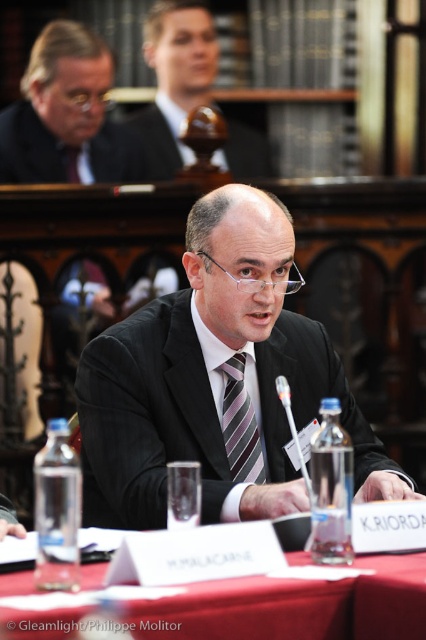
Which of these two, black matte suit at center or matte black suit at upper center, stands shorter?

black matte suit at center

The image size is (426, 640). Describe the element at coordinates (216, 381) in the screenshot. I see `black matte suit at center` at that location.

The image size is (426, 640). Find the location of `black matte suit at center`. black matte suit at center is located at coordinates (216, 381).

Which is in front, point (242, 168) or point (227, 385)?

Point (227, 385) is in front.

Does point (154, 134) lie in front of point (232, 408)?

No, it is behind (232, 408).

At what (x,y) coordinates should I click in order to perform the action: click on matte black suit at upper center. Please return your answer as a coordinate pair (x, y). The image size is (426, 640). Looking at the image, I should click on (175, 77).

Locate an element on the screen. The height and width of the screenshot is (640, 426). matte black suit at upper center is located at coordinates (175, 77).

Which is more to the right, red cloth table at center or matte brown wooden object at upper center?

red cloth table at center

Does red cloth table at center have a lesser height compared to matte brown wooden object at upper center?

Correct, red cloth table at center is not as tall as matte brown wooden object at upper center.

Locate an element on the screen. The height and width of the screenshot is (640, 426). red cloth table at center is located at coordinates (294, 605).